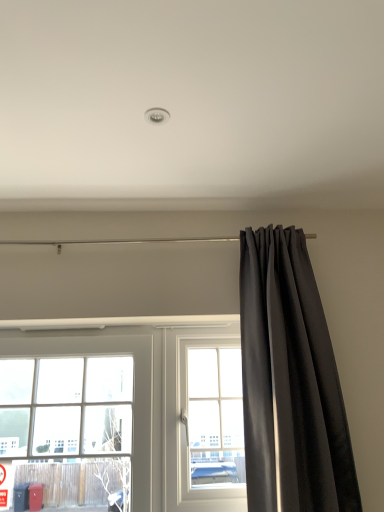
Question: Does clear glass window at center, which ranks as the first window in right-to-left order, appear on the right side of clear glass window at left, the 2th window positioned from the right?

Choices:
 (A) no
 (B) yes

Answer: (B)

Question: Is clear glass window at center, which ranks as the first window in right-to-left order, oriented away from clear glass window at left, the 2th window positioned from the right?

Choices:
 (A) yes
 (B) no

Answer: (B)

Question: Can you confirm if clear glass window at center, which ranks as the first window in right-to-left order, is shorter than clear glass window at left, the first window when ordered from left to right?

Choices:
 (A) yes
 (B) no

Answer: (A)

Question: Can we say clear glass window at center, arranged as the 2th window when viewed from the left, lies outside clear glass window at left, the first window when ordered from left to right?

Choices:
 (A) yes
 (B) no

Answer: (A)

Question: From a real-world perspective, is clear glass window at center, which ranks as the first window in right-to-left order, beneath clear glass window at left, the first window when ordered from left to right?

Choices:
 (A) yes
 (B) no

Answer: (B)

Question: Is black velvet curtain at right bigger or smaller than clear glass window at center, arranged as the 2th window when viewed from the left?

Choices:
 (A) small
 (B) big

Answer: (B)

Question: Would you say black velvet curtain at right is inside or outside clear glass window at center, arranged as the 2th window when viewed from the left?

Choices:
 (A) inside
 (B) outside

Answer: (B)

Question: From a real-world perspective, is black velvet curtain at right above or below clear glass window at center, arranged as the 2th window when viewed from the left?

Choices:
 (A) above
 (B) below

Answer: (A)

Question: Considering the positions of black velvet curtain at right and clear glass window at center, arranged as the 2th window when viewed from the left, in the image, is black velvet curtain at right taller or shorter than clear glass window at center, arranged as the 2th window when viewed from the left,?

Choices:
 (A) short
 (B) tall

Answer: (B)

Question: Considering the positions of point (180, 343) and point (187, 343), is point (180, 343) closer or farther from the camera than point (187, 343)?

Choices:
 (A) closer
 (B) farther

Answer: (A)

Question: In the image, is clear glass window at center, which ranks as the first window in right-to-left order, positioned in front of or behind clear glass window at left, the first window when ordered from left to right?

Choices:
 (A) behind
 (B) front

Answer: (A)

Question: Considering the positions of clear glass window at center, arranged as the 2th window when viewed from the left, and clear glass window at left, the first window when ordered from left to right, in the image, is clear glass window at center, arranged as the 2th window when viewed from the left, wider or thinner than clear glass window at left, the first window when ordered from left to right,?

Choices:
 (A) wide
 (B) thin

Answer: (B)

Question: From a real-world perspective, relative to clear glass window at left, the first window when ordered from left to right, is clear glass window at center, arranged as the 2th window when viewed from the left, vertically above or below?

Choices:
 (A) below
 (B) above

Answer: (B)

Question: In the image, is clear glass window at left, the first window when ordered from left to right, positioned in front of or behind clear glass window at center, which ranks as the first window in right-to-left order?

Choices:
 (A) front
 (B) behind

Answer: (A)

Question: Considering the relative positions of clear glass window at left, the 2th window positioned from the right, and clear glass window at center, arranged as the 2th window when viewed from the left, in the image provided, is clear glass window at left, the 2th window positioned from the right, to the left or to the right of clear glass window at center, arranged as the 2th window when viewed from the left,?

Choices:
 (A) left
 (B) right

Answer: (A)